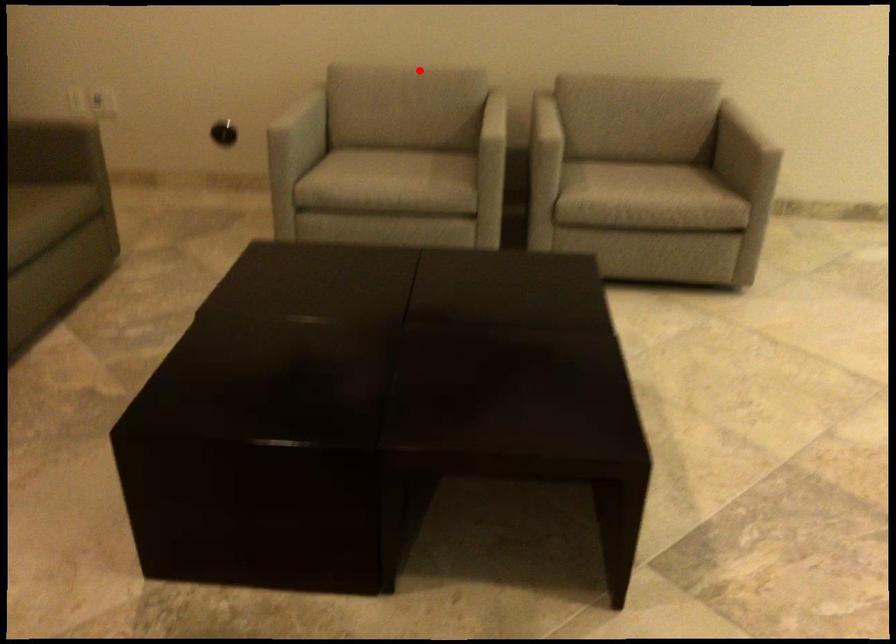
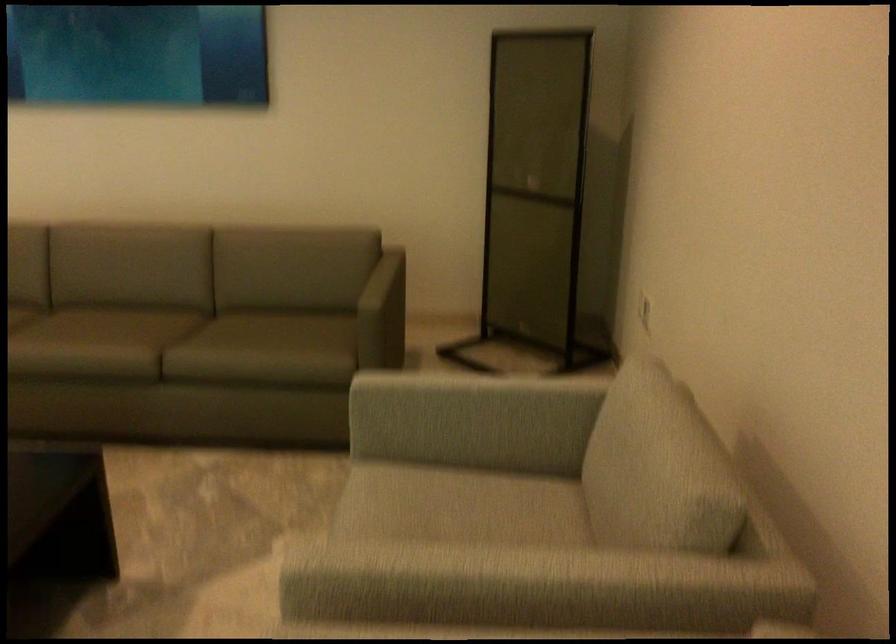
The point at the highlighted location is marked in the first image. Where is the corresponding point in the second image?

(653, 451)